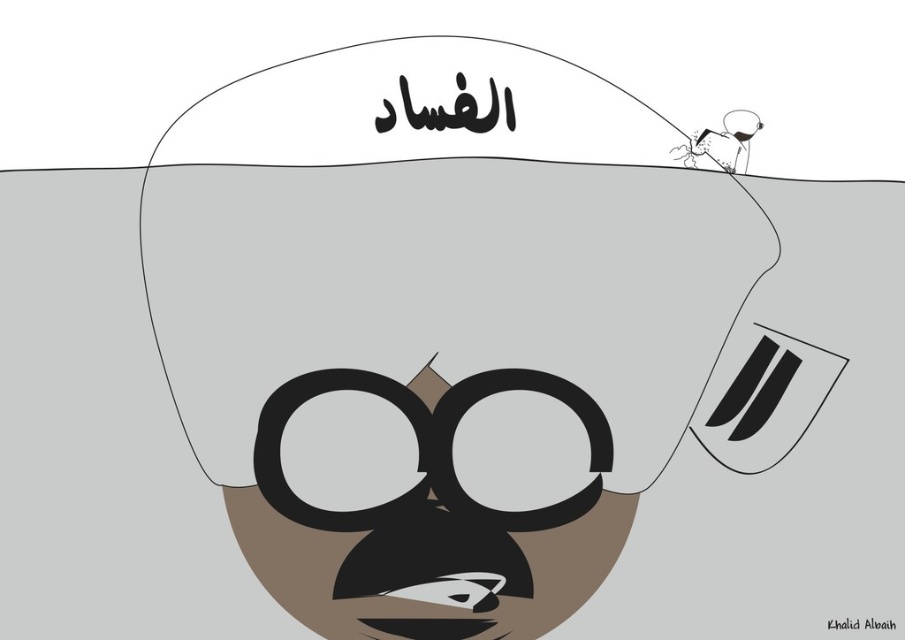
You are a character in a game who needs to wear protective gear. You see a white matte helmet at upper center and black matte goggles at center. Which one should you put on first according to the spatial arrangement?

You should put on the black matte goggles at center first because the white matte helmet at upper center is located above it, meaning the goggles are lower and closer to your face.

You are a photographer taking a picture of the scene. You want to focus on the point closer to you. Which point should you choose between point (307,406) and point (380,515)?

Point (307,406) is further to the camera than point (380,515), so you should choose point (307,406) to focus on the closer point.